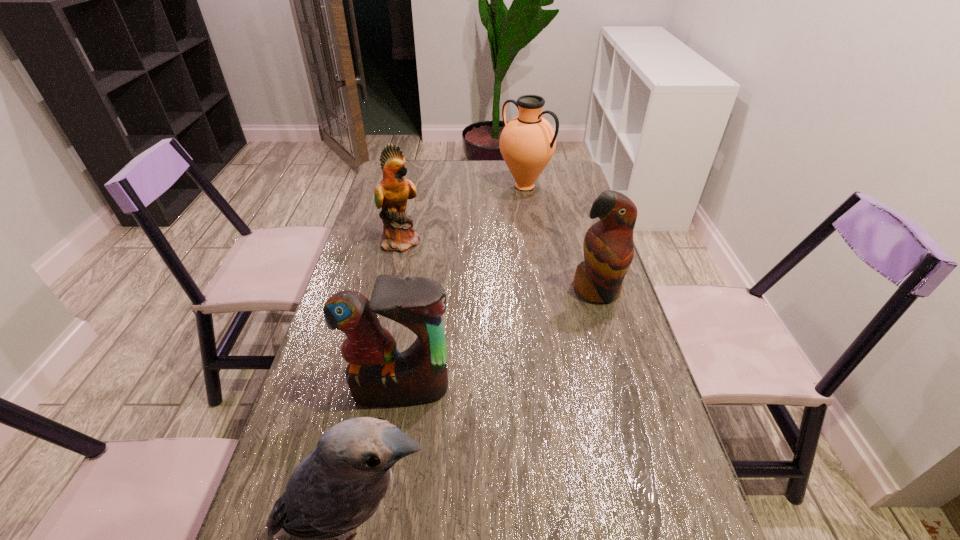
Image resolution: width=960 pixels, height=540 pixels. Find the location of `the second farthest object`. the second farthest object is located at coordinates (391, 193).

Where is `the farthest object`? The image size is (960, 540). the farthest object is located at coordinates (527, 143).

Identify the location of the third nearest object. (608, 247).

The image size is (960, 540). Identify the location of the second farthest parrot. (608, 247).

This screenshot has width=960, height=540. Identify the location of the fourth farthest object. (378, 374).

Locate an element on the screen. This screenshot has height=540, width=960. vacant space located 0.190m on the front-facing side of the second farthest object is located at coordinates (481, 241).

What are the coordinates of `vacant space located 0.130m on the front of the pitcher` in the screenshot? It's located at (530, 220).

Identify the location of free spot located 0.090m on the face of the third farthest object. (610, 335).

Where is `vacant space located at the face of the second nearest object`? The image size is (960, 540). vacant space located at the face of the second nearest object is located at coordinates (393, 439).

What are the coordinates of `object situated at the far edge` in the screenshot? It's located at (527, 143).